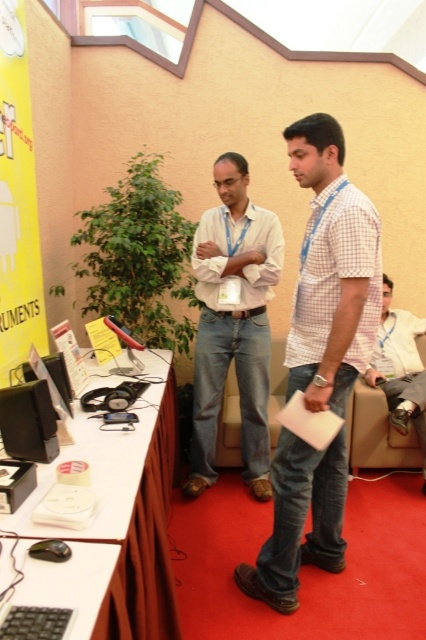
Describe the element at coordinates (17, 204) in the screenshot. The image size is (426, 640). I see `yellow paper at upper left` at that location.

Is yellow paper at upper left wider than black plastic keyboard at lower left?

No.

This screenshot has height=640, width=426. I want to click on yellow paper at upper left, so click(x=17, y=204).

Which of these two, white glossy table at lower left or black plastic keyboard at lower left, stands taller?

white glossy table at lower left is taller.

Is point (118, 488) closer to viewer compared to point (80, 550)?

No, it is behind (80, 550).

Is point (0, 525) closer to viewer compared to point (17, 547)?

No, it is behind (17, 547).

At what (x,y) coordinates should I click in order to perform the action: click on white glossy table at lower left. Please return your answer as a coordinate pair (x, y). Looking at the image, I should click on (120, 516).

Is white checkered shirt at center above light beige shirt at center?

No.

Is the position of white checkered shirt at center more distant than that of light beige shirt at center?

No, it is in front of light beige shirt at center.

Who is more forward, (345, 209) or (259, 276)?

Answer: Positioned in front is point (345, 209).

Find the location of a particular element. white checkered shirt at center is located at coordinates (331, 272).